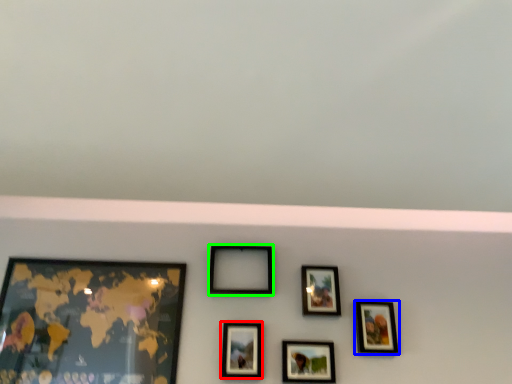
Question: Based on their relative distances, which object is nearer to picture frame (highlighted by a red box)? Choose from picture frame (highlighted by a blue box) and picture frame (highlighted by a green box).

Choices:
 (A) picture frame
 (B) picture frame

Answer: (B)